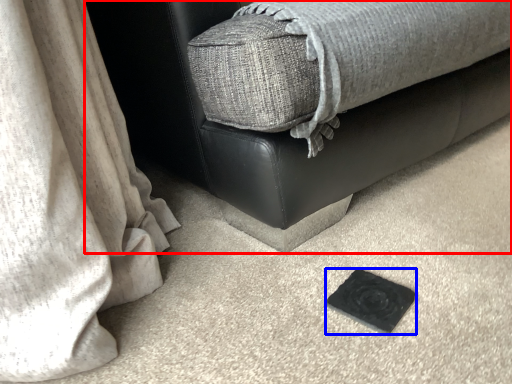
Question: Among these objects, which one is nearest to the camera, furniture (highlighted by a red box) or pad (highlighted by a blue box)?

Choices:
 (A) furniture
 (B) pad

Answer: (A)